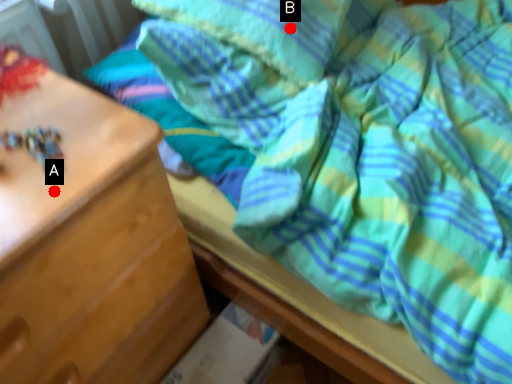
Question: Two points are circled on the image, labeled by A and B beside each circle. Which point appears closest to the camera in this image?

Choices:
 (A) A is closer
 (B) B is closer

Answer: (A)